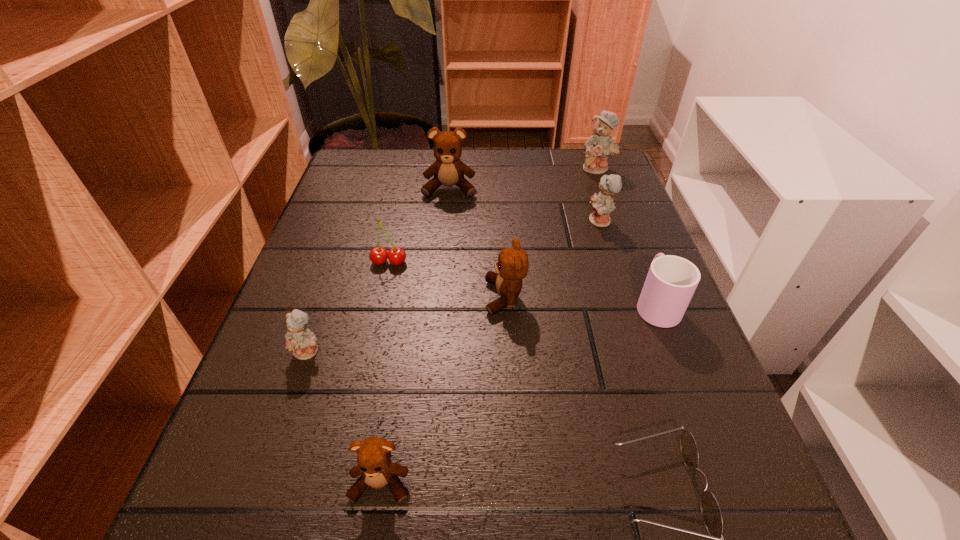
Identify the location of vacant point located between the farthest brown teddy bear and the smallest blue teddy bear. (379, 270).

You are a GUI agent. You are given a task and a screenshot of the screen. Output one action in this format:
    pyautogui.click(x=<x>, y=<y>)
    Task: Click on the unoccupied area between the fifth farthest teddy bear and the fourth teddy bear from left to right
    The height and width of the screenshot is (540, 960).
    Given the screenshot: What is the action you would take?
    pyautogui.click(x=407, y=324)

The width and height of the screenshot is (960, 540). I want to click on free space between the farthest object and the second nearest brown teddy bear, so click(551, 233).

At what (x,y) coordinates should I click in order to perform the action: click on vacant area between the farthest object and the cup. Please return your answer as a coordinate pair (x, y). The height and width of the screenshot is (540, 960). Looking at the image, I should click on (627, 236).

Find the location of a particular element. vacant area that lies between the farthest teddy bear and the smallest brown teddy bear is located at coordinates (489, 326).

You are a GUI agent. You are given a task and a screenshot of the screen. Output one action in this format:
    pyautogui.click(x=<x>, y=<y>)
    Task: Click on the free point between the third nearest object and the fifth object from left to right
    
    Given the screenshot: What is the action you would take?
    pyautogui.click(x=407, y=324)

Where is `free space between the red cherry and the farthest object`? Image resolution: width=960 pixels, height=540 pixels. free space between the red cherry and the farthest object is located at coordinates (493, 215).

The height and width of the screenshot is (540, 960). In order to click on object that is the closest to the farthest teddy bear in this screenshot , I will do `click(602, 204)`.

Identify which object is the nearest to the farthest blue teddy bear. Please provide its 2D coordinates. Your answer should be formatted as a tuple, i.e. [(x, y)], where the tuple contains the x and y coordinates of a point satisfying the conditions above.

[(602, 204)]

The height and width of the screenshot is (540, 960). What are the coordinates of `teddy bear that is the fourth closest to the leftmost teddy bear` in the screenshot? It's located at (602, 204).